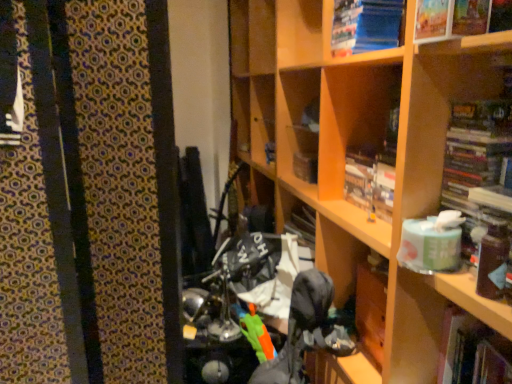
Describe the element at coordinates (476, 150) in the screenshot. The image size is (512, 384). I see `hardcover book at right, which is counted as the fourth book, starting from the top` at that location.

Image resolution: width=512 pixels, height=384 pixels. Describe the element at coordinates (473, 352) in the screenshot. I see `hardcover book at lower right, acting as the first book starting from the bottom` at that location.

Measure the distance between point (389, 171) and camera.

Point (389, 171) and camera are 4.06 feet apart from each other.

Locate an element on the screen. The width and height of the screenshot is (512, 384). hardcover book at upper center, which appears as the third book when ordered from the bottom is located at coordinates (370, 181).

Describe the element at coordinates (452, 18) in the screenshot. I see `matte paper book at upper right, which ranks as the 2th book in top-to-bottom order` at that location.

You are a GUI agent. You are given a task and a screenshot of the screen. Output one action in this format:
    pyautogui.click(x=<x>, y=<y>)
    Task: Click on the hardcover book at right, which is counted as the fourth book, starting from the top
    The image size is (512, 384).
    Given the screenshot: What is the action you would take?
    pyautogui.click(x=476, y=150)

Between point (478, 115) and point (399, 19), which one is positioned in front?

Positioned in front is point (478, 115).

This screenshot has height=384, width=512. What are the coordinates of `the 3rd book below the blue paper at upper right, arranged as the 5th book when ordered from the bottom (from the image's perspective)` in the screenshot? It's located at (476, 150).

In the scene shown: What's the angular difference between hardcover book at right, which is counted as the fourth book, starting from the top, and blue paper at upper right, which appears as the 1th book when viewed from the top,'s facing directions?

hardcover book at right, which is counted as the fourth book, starting from the top, and blue paper at upper right, which appears as the 1th book when viewed from the top, are facing 0.000949 degrees away from each other.

Measure the distance from hardcover book at right, which appears as the second book when ordered from the bottom, to blue paper at upper right, which appears as the 1th book when viewed from the top.

hardcover book at right, which appears as the second book when ordered from the bottom, is 16.47 inches from blue paper at upper right, which appears as the 1th book when viewed from the top.

In terms of size, does blue paper at upper right, which appears as the 1th book when viewed from the top, appear bigger or smaller than hardcover book at right, which appears as the second book when ordered from the bottom?

blue paper at upper right, which appears as the 1th book when viewed from the top, is bigger than hardcover book at right, which appears as the second book when ordered from the bottom.

Considering the positions of point (373, 48) and point (496, 117), is point (373, 48) closer or farther from the camera than point (496, 117)?

Point (373, 48) appears to be farther away from the viewer than point (496, 117).

How many degrees apart are the facing directions of blue paper at upper right, arranged as the 5th book when ordered from the bottom, and hardcover book at right, which appears as the second book when ordered from the bottom?

blue paper at upper right, arranged as the 5th book when ordered from the bottom, and hardcover book at right, which appears as the second book when ordered from the bottom, are facing 0.000949 degrees away from each other.

From the image's perspective, is blue paper at upper right, which appears as the 1th book when viewed from the top, above or below hardcover book at right, which is counted as the fourth book, starting from the top?

blue paper at upper right, which appears as the 1th book when viewed from the top, is above hardcover book at right, which is counted as the fourth book, starting from the top.

Does hardcover book at right, which is counted as the fourth book, starting from the top, have a greater height compared to hardcover book at upper center, the third book positioned from the top?

Correct, hardcover book at right, which is counted as the fourth book, starting from the top, is much taller as hardcover book at upper center, the third book positioned from the top.

What are the coordinates of `the 2nd book to the left of the hardcover book at right, which is counted as the fourth book, starting from the top, starting your count from the anchor` in the screenshot? It's located at (370, 181).

Does point (444, 197) come closer to viewer compared to point (356, 198)?

Yes, point (444, 197) is closer to viewer.

Looking at this image, between hardcover book at right, which is counted as the fourth book, starting from the top, and hardcover book at upper center, the third book positioned from the top, which one appears on the right side from the viewer's perspective?

hardcover book at right, which is counted as the fourth book, starting from the top, is more to the right.

Between point (376, 157) and point (480, 13), which one is positioned in front?

Point (480, 13)

Would you say hardcover book at upper center, which appears as the third book when ordered from the bottom, contains matte paper book at upper right, positioned as the 4th book in bottom-to-top order?

No.

Would you consider hardcover book at upper center, which appears as the third book when ordered from the bottom, to be distant from matte paper book at upper right, which ranks as the 2th book in top-to-bottom order?

hardcover book at upper center, which appears as the third book when ordered from the bottom, is actually quite close to matte paper book at upper right, which ranks as the 2th book in top-to-bottom order.

I want to click on book that is the 1st one when counting downward from the matte paper book at upper right, positioned as the 4th book in bottom-to-top order (from the image's perspective), so click(370, 181).

Which is further, (394, 355) or (496, 345)?

Positioned behind is point (394, 355).

From a real-world perspective, is wooden bookshelf at center physically located above or below hardcover book at lower right, marked as the fifth book in a top-to-bottom arrangement?

Clearly, from a real-world perspective, wooden bookshelf at center is above hardcover book at lower right, marked as the fifth book in a top-to-bottom arrangement.

I want to click on book below the wooden bookshelf at center (from the image's perspective), so click(473, 352).

Would you consider wooden bookshelf at center to be distant from hardcover book at lower right, acting as the first book starting from the bottom?

No.

Is hardcover book at right, which appears as the second book when ordered from the bottom, wider than matte paper book at upper right, positioned as the 4th book in bottom-to-top order?

No.

Is hardcover book at right, which is counted as the fourth book, starting from the top, located outside matte paper book at upper right, which ranks as the 2th book in top-to-bottom order?

hardcover book at right, which is counted as the fourth book, starting from the top, lies outside matte paper book at upper right, which ranks as the 2th book in top-to-bottom order,'s area.

Is hardcover book at right, which appears as the second book when ordered from the bottom, oriented towards matte paper book at upper right, positioned as the 4th book in bottom-to-top order?

No.

From a real-world perspective, is hardcover book at right, which appears as the second book when ordered from the bottom, beneath matte paper book at upper right, positioned as the 4th book in bottom-to-top order?

Yes.

Does wooden bookshelf at center have a greater height compared to hardcover book at upper center, which appears as the third book when ordered from the bottom?

Correct, wooden bookshelf at center is much taller as hardcover book at upper center, which appears as the third book when ordered from the bottom.

In the scene shown: Does wooden bookshelf at center appear on the right side of hardcover book at upper center, the third book positioned from the top?

In fact, wooden bookshelf at center is to the left of hardcover book at upper center, the third book positioned from the top.

Starting from the wooden bookshelf at center, which book is the 5th one behind? Please provide its 2D coordinates.

[(370, 181)]

This screenshot has height=384, width=512. I want to click on the 3rd book positioned above the hardcover book at right, which appears as the second book when ordered from the bottom (from the image's perspective), so click(x=365, y=26).

You are a GUI agent. You are given a task and a screenshot of the screen. Output one action in this format:
    pyautogui.click(x=<x>, y=<y>)
    Task: Click on the 2nd book directly above the hardcover book at right, which is counted as the fourth book, starting from the top (from a real-world perspective)
    
    Given the screenshot: What is the action you would take?
    pyautogui.click(x=365, y=26)

From the image, which object appears to be farther from blue paper at upper right, arranged as the 5th book when ordered from the bottom, hardcover book at lower right, marked as the fifth book in a top-to-bottom arrangement, or hardcover book at upper center, which appears as the third book when ordered from the bottom?

hardcover book at lower right, marked as the fifth book in a top-to-bottom arrangement.

Considering their positions, is matte paper book at upper right, which ranks as the 2th book in top-to-bottom order, positioned closer to wooden bookshelf at center than blue paper at upper right, arranged as the 5th book when ordered from the bottom?

The object closer to wooden bookshelf at center is blue paper at upper right, arranged as the 5th book when ordered from the bottom.

Consider the image. Considering their positions, is blue paper at upper right, arranged as the 5th book when ordered from the bottom, positioned closer to matte paper book at upper right, which ranks as the 2th book in top-to-bottom order, than hardcover book at right, which is counted as the fourth book, starting from the top?

Among the two, hardcover book at right, which is counted as the fourth book, starting from the top, is located nearer to matte paper book at upper right, which ranks as the 2th book in top-to-bottom order.

Based on their spatial positions, is hardcover book at right, which appears as the second book when ordered from the bottom, or blue paper at upper right, arranged as the 5th book when ordered from the bottom, further from hardcover book at lower right, marked as the fifth book in a top-to-bottom arrangement?

blue paper at upper right, arranged as the 5th book when ordered from the bottom, is positioned further to the anchor hardcover book at lower right, marked as the fifth book in a top-to-bottom arrangement.

From the image, which object appears to be nearer to hardcover book at upper center, which appears as the third book when ordered from the bottom, hardcover book at lower right, acting as the first book starting from the bottom, or hardcover book at right, which is counted as the fourth book, starting from the top?

hardcover book at right, which is counted as the fourth book, starting from the top, lies closer to hardcover book at upper center, which appears as the third book when ordered from the bottom, than the other object.

Looking at the image, which one is located further to wooden bookshelf at center, hardcover book at lower right, marked as the fifth book in a top-to-bottom arrangement, or matte paper book at upper right, positioned as the 4th book in bottom-to-top order?

matte paper book at upper right, positioned as the 4th book in bottom-to-top order.

Considering their positions, is hardcover book at right, which is counted as the fourth book, starting from the top, positioned further to blue paper at upper right, which appears as the 1th book when viewed from the top, than wooden bookshelf at center?

hardcover book at right, which is counted as the fourth book, starting from the top, is positioned further to the anchor blue paper at upper right, which appears as the 1th book when viewed from the top.

When comparing their distances from matte paper book at upper right, which ranks as the 2th book in top-to-bottom order, does wooden bookshelf at center or hardcover book at upper center, which appears as the third book when ordered from the bottom, seem further?

hardcover book at upper center, which appears as the third book when ordered from the bottom, lies further to matte paper book at upper right, which ranks as the 2th book in top-to-bottom order, than the other object.

Locate an element on the screen. Image resolution: width=512 pixels, height=384 pixels. shelf between hardcover book at right, which is counted as the fourth book, starting from the top, and hardcover book at lower right, marked as the fifth book in a top-to-bottom arrangement, in the vertical direction is located at coordinates (361, 147).

Locate an element on the screen. shelf between blue paper at upper right, which appears as the 1th book when viewed from the top, and hardcover book at lower right, acting as the first book starting from the bottom, from top to bottom is located at coordinates (361, 147).

I want to click on shelf between matte paper book at upper right, which ranks as the 2th book in top-to-bottom order, and hardcover book at lower right, marked as the fifth book in a top-to-bottom arrangement, from top to bottom, so click(x=361, y=147).

Find the location of a particular element. book that lies between hardcover book at upper center, the third book positioned from the top, and hardcover book at lower right, marked as the fifth book in a top-to-bottom arrangement, from top to bottom is located at coordinates (476, 150).